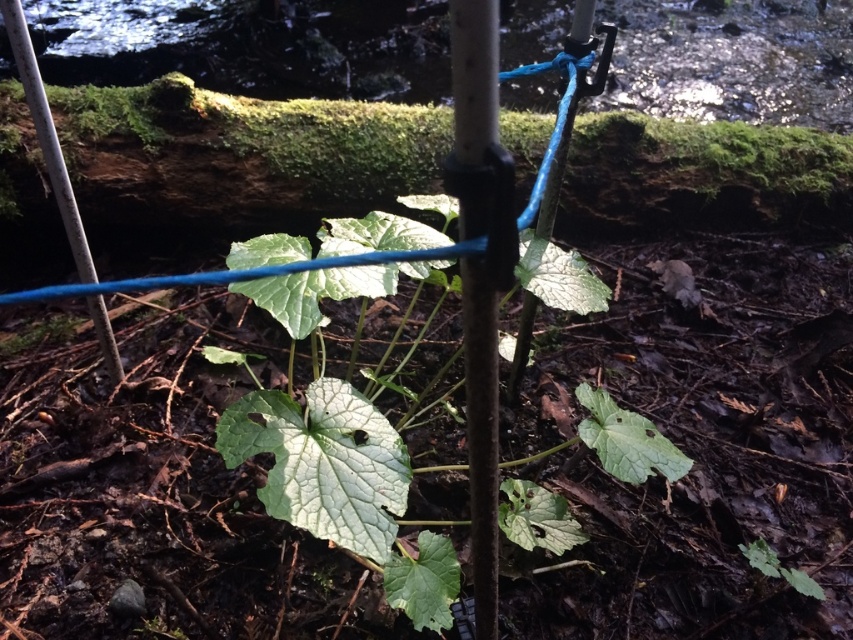
Question: Is smooth white pole at center bigger than white matte pole at left?

Choices:
 (A) no
 (B) yes

Answer: (A)

Question: Can you confirm if green matte leafy plant at center is wider than smooth white pole at center?

Choices:
 (A) no
 (B) yes

Answer: (B)

Question: Which is farther from the green matte leafy plant at center?

Choices:
 (A) smooth white pole at center
 (B) white matte pole at left

Answer: (B)

Question: Estimate the real-world distances between objects in this image. Which object is closer to the green matte leafy plant at center?

Choices:
 (A) white matte pole at left
 (B) smooth white pole at center

Answer: (B)

Question: Can you confirm if smooth white pole at center is wider than white matte pole at left?

Choices:
 (A) yes
 (B) no

Answer: (B)

Question: Which point is farther to the camera?

Choices:
 (A) green matte leafy plant at center
 (B) smooth white pole at center

Answer: (A)